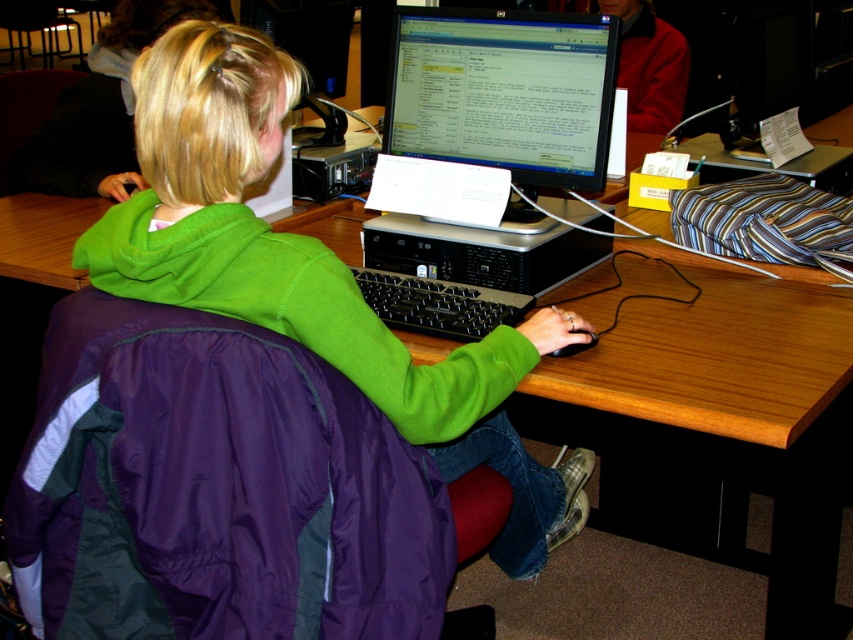
You are designing a new ergonomic setup for the person at the desk. The monitor needs to be positioned at a specific coordinate to ensure proper eye level. What are the coordinates where the matte black monitor at center should be placed?

The matte black monitor at center is already positioned at the coordinates point (503, 92), so it should remain there for proper eye level.

You are standing at the entrance of the workspace and see two points marked on the floor. The first point is at location point (509, 33) and the second point is at point (567, 346). Which point is closer to the entrance?

Point (509, 33) is behind point (567, 346), so the second point is closer to the entrance.

You are a delivery robot in a library. You need to deliver a package to a specific point marked at coordinates point (590, 237). The robot has a maximum reach distance of 1.5 meters. Can you reach the point from your current position?

The distance of point (590, 237) from camera is 1.61 meters, so the robot cannot reach the point as it exceeds the maximum reach distance of 1.5 meters.